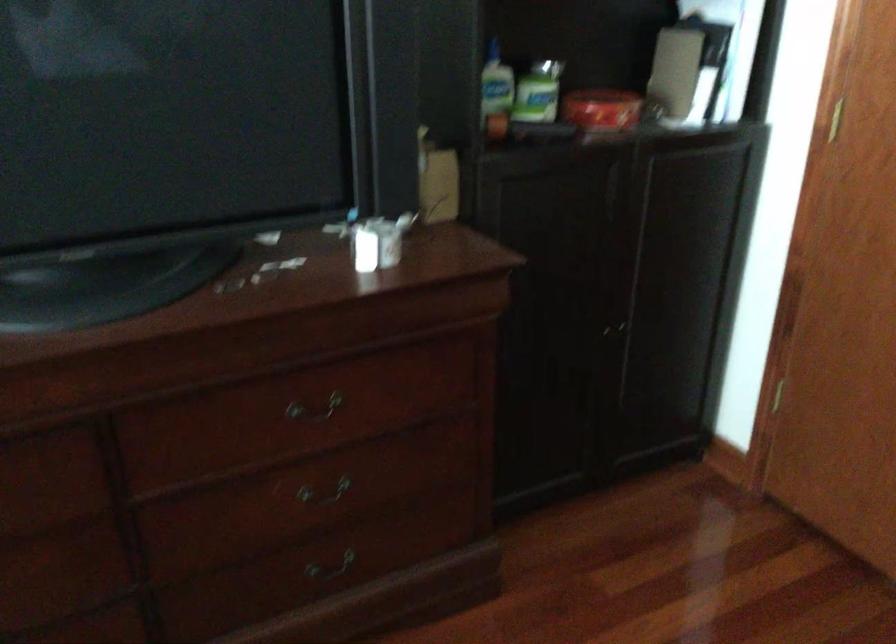
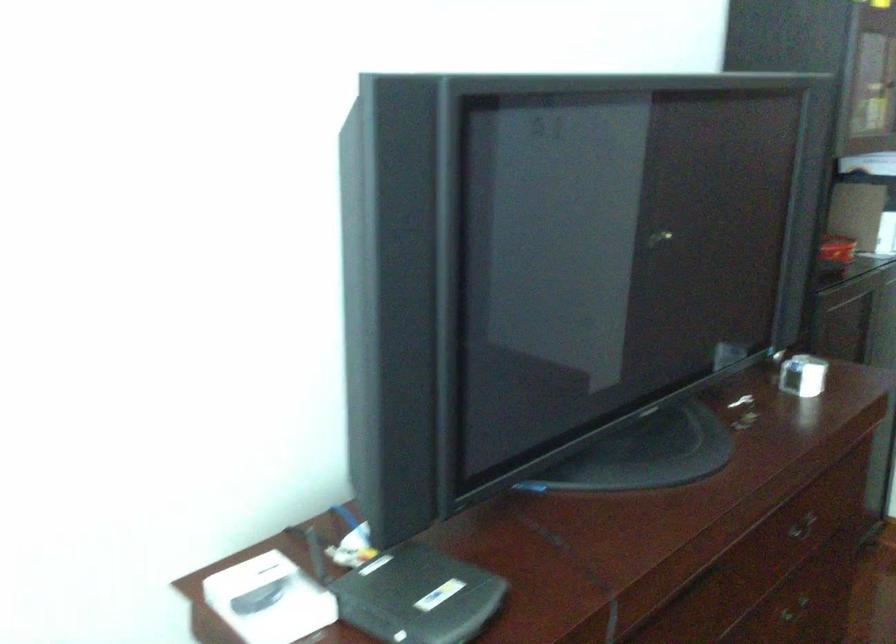
Question: Which direction would the cameraman need to move to produce the second image? Reply with the corresponding letter.

Choices:
 (A) Left
 (B) Right
 (C) Forward
 (D) Backward

Answer: (A)